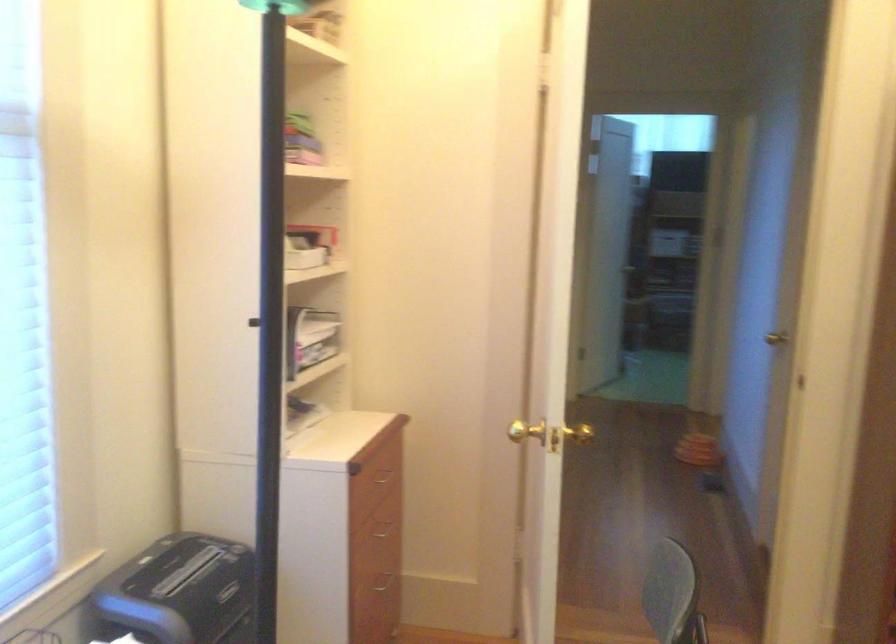
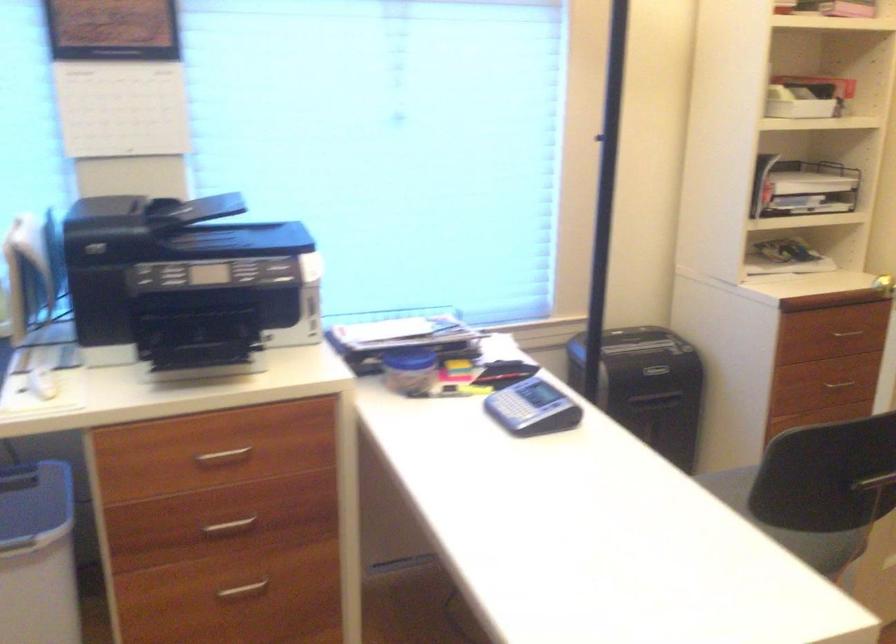
Question: The first image is from the beginning of the video and the second image is from the end. How did the camera likely rotate when shooting the video?

Choices:
 (A) Left
 (B) Right
 (C) Up
 (D) Down

Answer: (A)